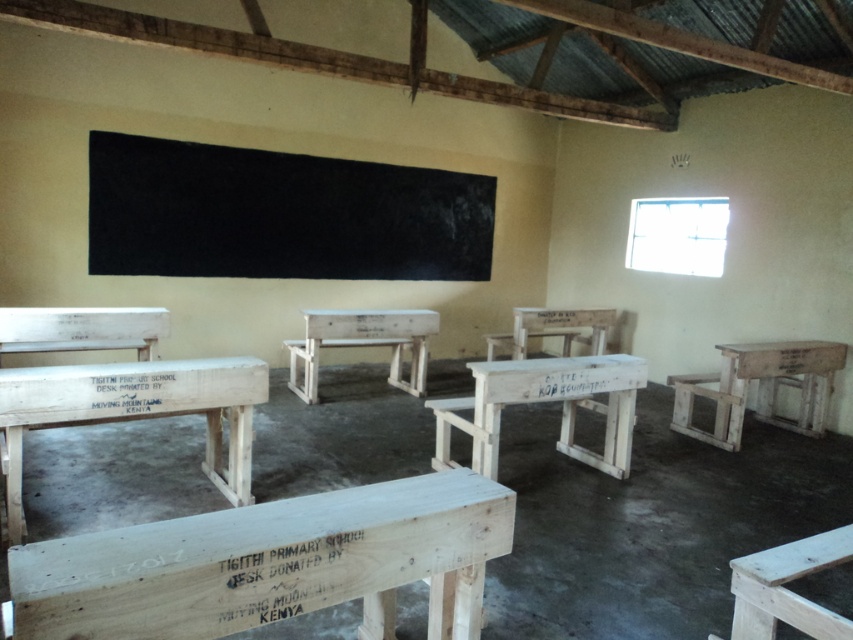
You are a student entering the classroom and need to find a place to sit. You see the white wood bench at left and the light brown wooden stool at lower right. Which one is closer to the entrance?

The white wood bench at left is closer to the entrance because it is positioned to the left of the light brown wooden stool at lower right, which is further away from the entrance.

You are a student who needs to sit down. You see a white wood bench at center and a white wooden desk at right. Which one is shorter and thus more comfortable for sitting?

The white wood bench at center is shorter than the white wooden desk at right, so it is more comfortable for sitting.